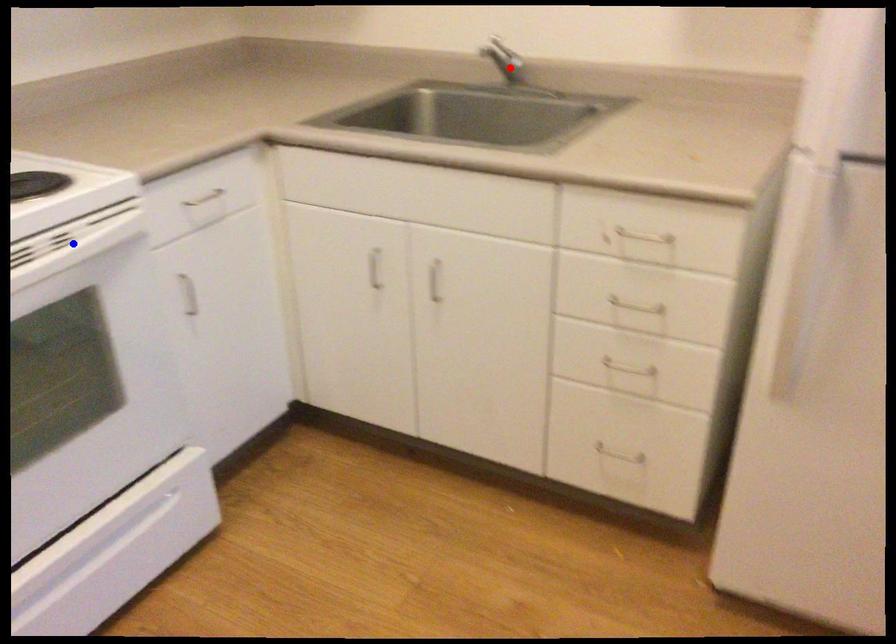
Question: Two points are marked on the image. Which point is closer to the camera?

Choices:
 (A) Blue point is closer.
 (B) Red point is closer.

Answer: (A)